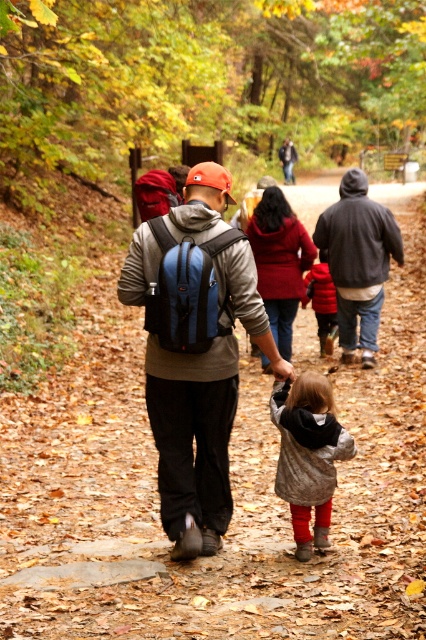
Between matte blue backpack at center and dark gray hoodie at center, which one is positioned lower?

matte blue backpack at center is lower down.

I want to click on matte blue backpack at center, so click(x=204, y=404).

Where is `matte blue backpack at center`? The width and height of the screenshot is (426, 640). matte blue backpack at center is located at coordinates (204, 404).

At what (x,y) coordinates should I click in order to perform the action: click on matte blue backpack at center. Please return your answer as a coordinate pair (x, y). The height and width of the screenshot is (640, 426). Looking at the image, I should click on (204, 404).

Does velvet red coat at center have a greater height compared to red fleece jacket at center?

Yes.

Describe the element at coordinates (279, 262) in the screenshot. I see `velvet red coat at center` at that location.

The height and width of the screenshot is (640, 426). What do you see at coordinates (279, 262) in the screenshot? I see `velvet red coat at center` at bounding box center [279, 262].

This screenshot has height=640, width=426. I want to click on velvet red coat at center, so click(279, 262).

Measure the distance between point (236, 280) and camera.

Point (236, 280) is 4.63 meters away from camera.

Between point (213, 220) and point (311, 243), which one is positioned behind?

Point (311, 243)

Who is more distant from viewer, (198, 243) or (287, 212)?

Positioned behind is point (287, 212).

The image size is (426, 640). What are the coordinates of `matte blue backpack at center` in the screenshot? It's located at (204, 404).